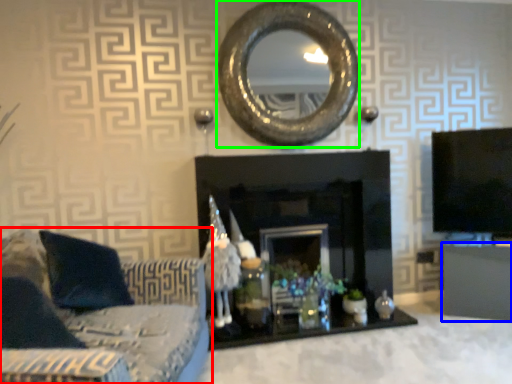
Question: Which is nearer to the studio couch (highlighted by a red box)? furniture (highlighted by a blue box) or oval (highlighted by a green box).

Choices:
 (A) furniture
 (B) oval

Answer: (B)